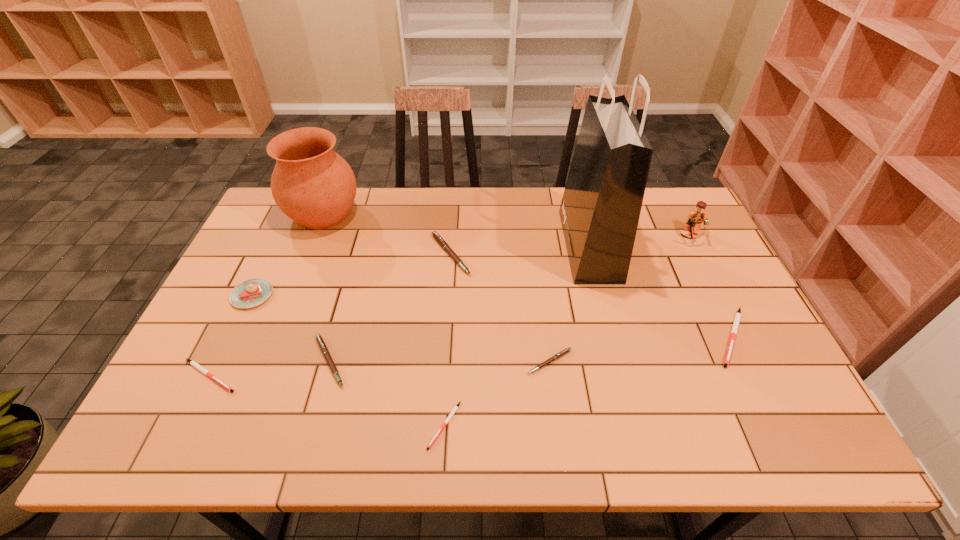
Image resolution: width=960 pixels, height=540 pixels. I want to click on gray shopping bag, so click(600, 209).

Identify the location of the third object from right to left. (600, 209).

This screenshot has height=540, width=960. I want to click on pottery, so click(313, 185).

In order to click on Lego in this screenshot , I will do `click(694, 219)`.

Where is `pastry`? Image resolution: width=960 pixels, height=540 pixels. pastry is located at coordinates (252, 292).

What are the coordinates of `the biggest pink pen` in the screenshot? It's located at (440, 240).

Image resolution: width=960 pixels, height=540 pixels. Identify the location of the tallest pen. (440, 240).

This screenshot has height=540, width=960. Identify the location of the leftmost pink pen. (322, 345).

This screenshot has height=540, width=960. Find the location of `the fifth pen from right to left`. the fifth pen from right to left is located at coordinates (322, 345).

The width and height of the screenshot is (960, 540). What are the coordinates of `the biggest white pen` in the screenshot? It's located at (738, 315).